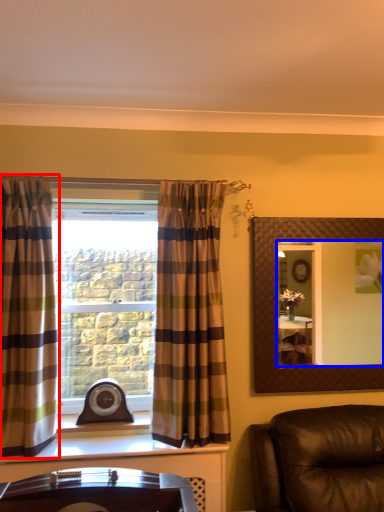
Question: Which point is closer to the camera, curtain (highlighted by a red box) or mirror (highlighted by a blue box)?

Choices:
 (A) curtain
 (B) mirror

Answer: (A)